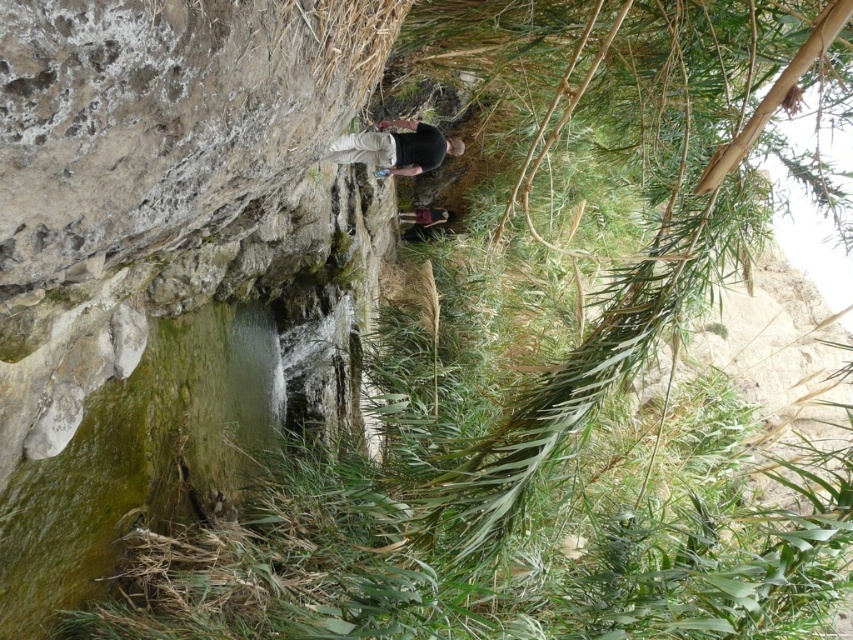
Between rough stone cliff at upper left and black matte shirt at center, which one has more height?

Standing taller between the two is black matte shirt at center.

Image resolution: width=853 pixels, height=640 pixels. What do you see at coordinates (169, 259) in the screenshot? I see `rough stone cliff at upper left` at bounding box center [169, 259].

Is point (236, 44) farther from camera compared to point (375, 161)?

No, (236, 44) is in front of (375, 161).

Find the location of `rough stone cliff at upper left`. rough stone cliff at upper left is located at coordinates (169, 259).